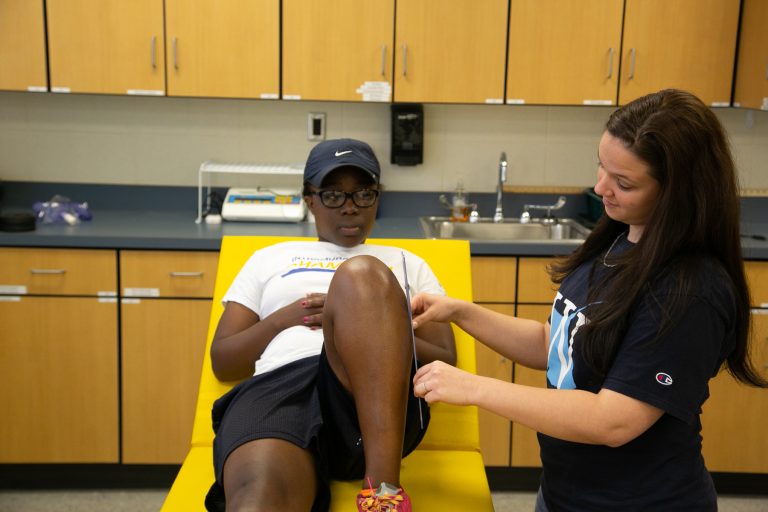
You are a GUI agent. You are given a task and a screenshot of the screen. Output one action in this format:
    pyautogui.click(x=<x>, y=<y>)
    Task: Click on the sink
    This screenshot has width=768, height=512.
    Given the screenshot: What is the action you would take?
    pyautogui.click(x=502, y=226)